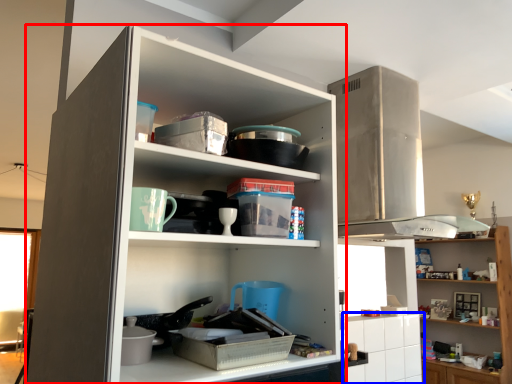
Question: Which object appears farthest to the camera in this image, cupboard (highlighted by a red box) or cabinetry (highlighted by a blue box)?

Choices:
 (A) cupboard
 (B) cabinetry

Answer: (B)